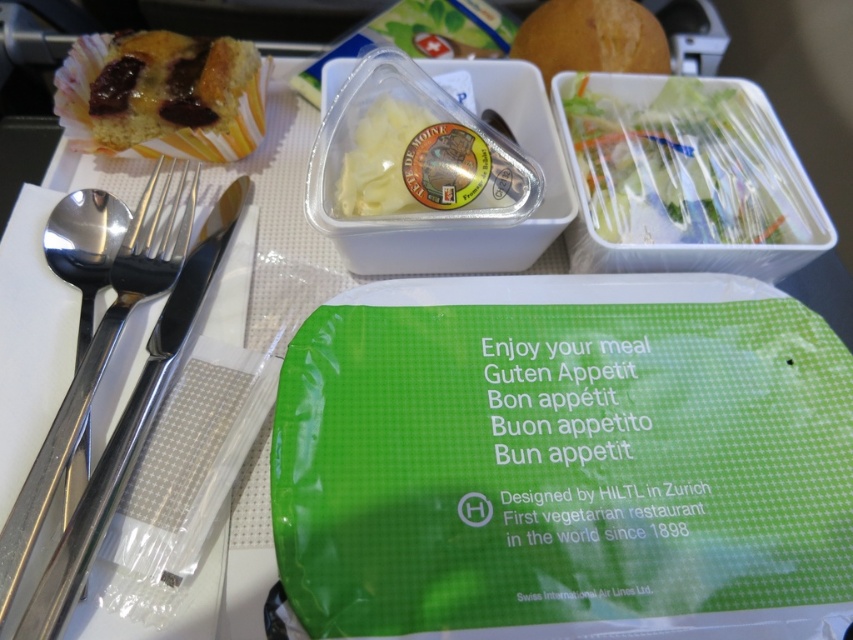
Question: Which of the following is the farthest from the observer?

Choices:
 (A) (117, 305)
 (B) (90, 148)
 (C) (352, 150)
 (D) (758, 204)

Answer: (B)

Question: In this image, where is golden brown cake at upper left located relative to satin finish silverware at left?

Choices:
 (A) below
 (B) above

Answer: (B)

Question: Which point appears closest to the camera in this image?

Choices:
 (A) (173, 140)
 (B) (403, 161)
 (C) (648, 212)

Answer: (B)

Question: Which point is closer to the camera taking this photo?

Choices:
 (A) (386, 100)
 (B) (119, 496)
 (C) (218, 100)
 (D) (787, 163)

Answer: (B)

Question: Does golden brown cake at upper left have a larger size compared to translucent plastic cheese at center?

Choices:
 (A) yes
 (B) no

Answer: (A)

Question: Can you confirm if golden brown cake at upper left is smaller than translucent plastic cheese at center?

Choices:
 (A) no
 (B) yes

Answer: (A)